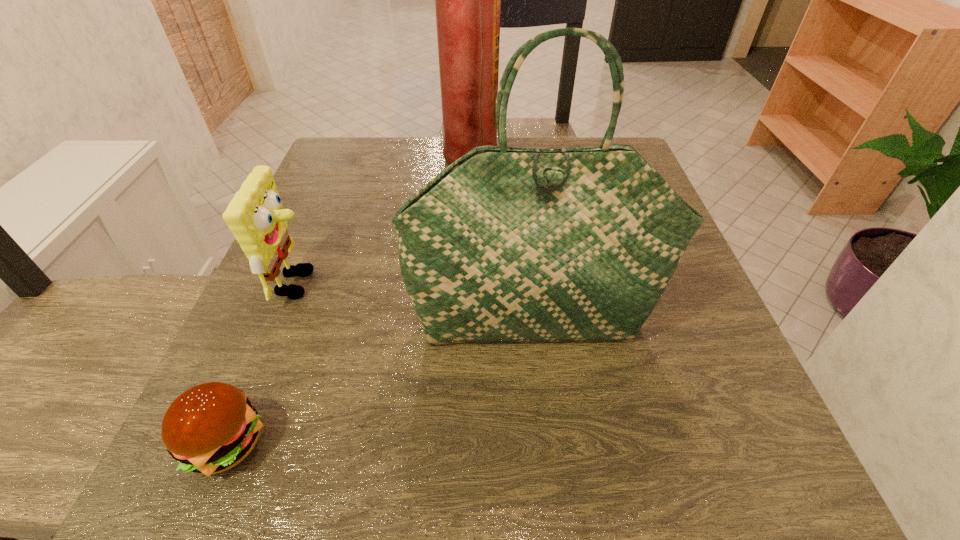
This screenshot has width=960, height=540. In order to click on the farthest object in this screenshot , I will do point(467,0).

You are a GUI agent. You are given a task and a screenshot of the screen. Output one action in this format:
    pyautogui.click(x=<x>, y=<y>)
    Task: Click on the tote bag
    Image resolution: width=960 pixels, height=540 pixels.
    Given the screenshot: What is the action you would take?
    pyautogui.click(x=506, y=245)

Where is `the third tallest object`? The image size is (960, 540). the third tallest object is located at coordinates (255, 215).

Where is `the shortest object`? The image size is (960, 540). the shortest object is located at coordinates (210, 428).

You are a GUI agent. You are given a task and a screenshot of the screen. Output one action in this format:
    pyautogui.click(x=<x>, y=<y>)
    Task: Click on the hamburger
    Image resolution: width=960 pixels, height=540 pixels.
    Given the screenshot: What is the action you would take?
    pyautogui.click(x=210, y=428)

Find the location of a particular element. vacant space situated on the side of the farthest object with the label is located at coordinates (610, 162).

Where is `free space located on the front of the tote bag`? The width and height of the screenshot is (960, 540). free space located on the front of the tote bag is located at coordinates (545, 419).

This screenshot has width=960, height=540. Identify the location of vacant space situated on the face of the sponge. (461, 284).

I want to click on blank area located on the back of the nearest object, so click(x=280, y=313).

Find the location of a particular element. The image size is (960, 540). object that is positioned at the far edge is located at coordinates (467, 0).